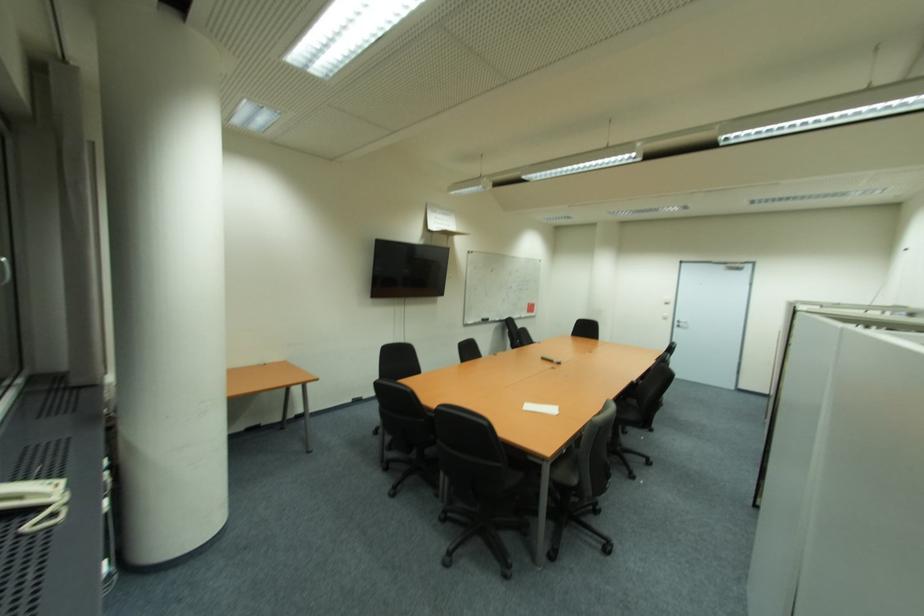
Where would you lift the white telephone handset? Please return your answer as a coordinate pair (x, y).

(30, 488)